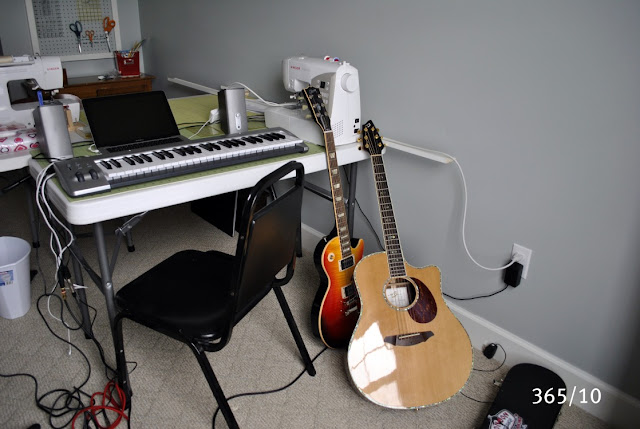
Where is `laptop`? This screenshot has width=640, height=429. laptop is located at coordinates (148, 112).